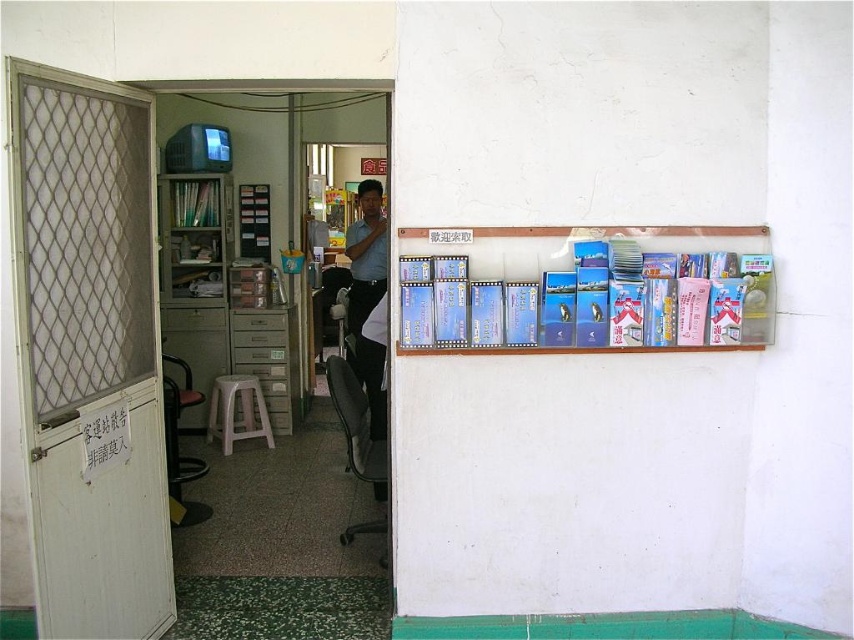
Question: Which of these objects is positioned farthest from the white plastic stool at lower center?

Choices:
 (A) matte plastic bookshelf at left
 (B) clear plastic cards at upper right

Answer: (B)

Question: Which point appears closest to the camera in this image?

Choices:
 (A) (194, 266)
 (B) (357, 193)
 (C) (537, 259)

Answer: (C)

Question: Can you confirm if matte blue shirt at center is positioned to the right of clear plastic cards at upper right?

Choices:
 (A) yes
 (B) no

Answer: (B)

Question: Can you confirm if matte blue shirt at center is positioned to the right of white plastic stool at lower center?

Choices:
 (A) no
 (B) yes

Answer: (B)

Question: Which object is positioned farthest from the matte blue shirt at center?

Choices:
 (A) matte plastic bookshelf at left
 (B) clear plastic cards at upper right
 (C) white plastic stool at lower center

Answer: (B)

Question: Is matte plastic bookshelf at left to the right of clear plastic cards at upper right from the viewer's perspective?

Choices:
 (A) no
 (B) yes

Answer: (A)